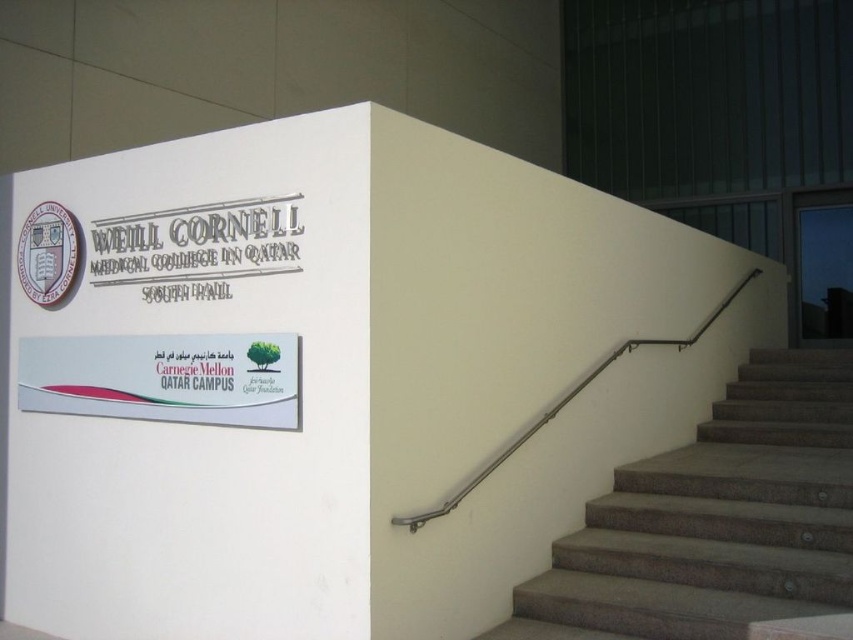
Question: Which object appears closest to the camera in this image?

Choices:
 (A) satin silver handrail at right
 (B) gray textured stairs at right

Answer: (A)

Question: Does gray textured stairs at right appear under satin silver handrail at right?

Choices:
 (A) yes
 (B) no

Answer: (A)

Question: From the image, what is the correct spatial relationship of gray textured stairs at right in relation to satin silver handrail at right?

Choices:
 (A) right
 (B) left

Answer: (A)

Question: Can you confirm if gray textured stairs at right is wider than satin silver handrail at right?

Choices:
 (A) no
 (B) yes

Answer: (B)